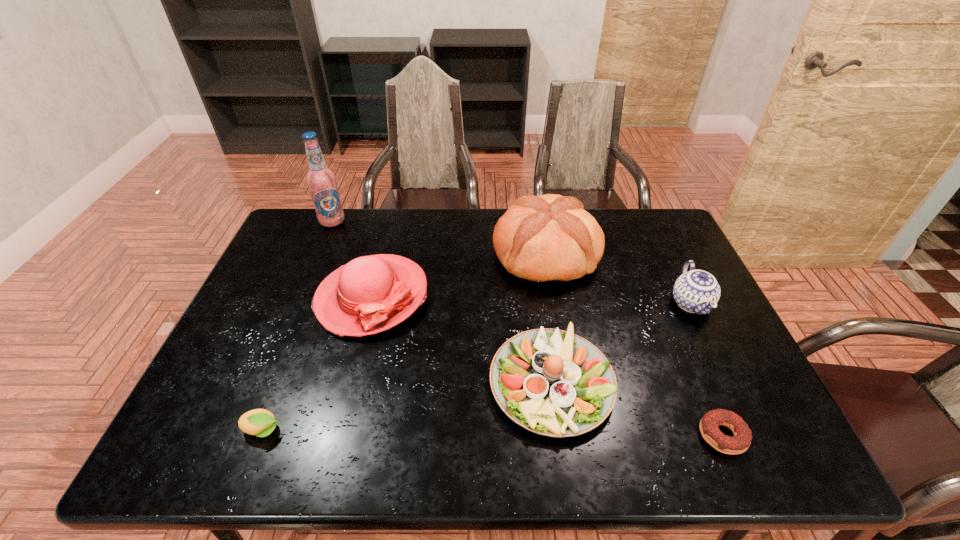
Identify the location of lemon situated at the left edge. The width and height of the screenshot is (960, 540). (260, 422).

Identify the location of chinaware that is at the right edge. The width and height of the screenshot is (960, 540). (696, 291).

The height and width of the screenshot is (540, 960). Find the location of `doughnut that is at the right edge`. doughnut that is at the right edge is located at coordinates (709, 425).

Where is `object positioned at the far left corner`? object positioned at the far left corner is located at coordinates (321, 181).

Locate an element on the screen. object that is at the near left corner is located at coordinates (260, 422).

In order to click on object that is at the near right corner in this screenshot , I will do `click(709, 425)`.

The image size is (960, 540). I want to click on vacant region at the far edge, so click(x=332, y=251).

Find the location of a particular element. vacant space at the near edge is located at coordinates pyautogui.click(x=353, y=431).

Where is `vacant space at the right edge`? vacant space at the right edge is located at coordinates (746, 363).

In the image, there is a desktop. What are the coordinates of `vacant space at the far right corner` in the screenshot? It's located at (680, 246).